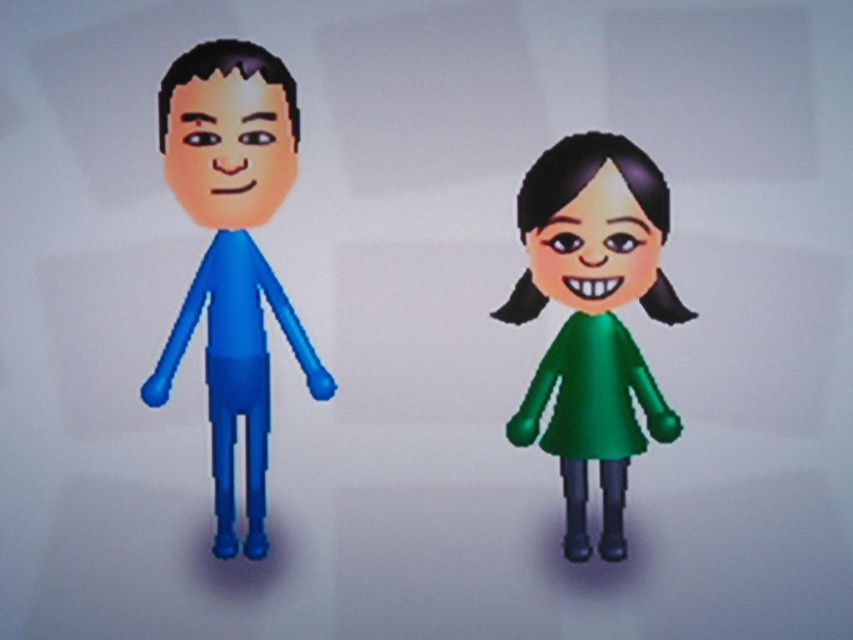
Consider the image. You are an artist trying to draw the two characters from the image. You notice that the matte orange face at left and the green matte face at right have different sizes. Which face should you make wider in your drawing to match the original image?

The matte orange face at left should be drawn wider than the green matte face at right because its width is larger according to the description.

Consider the image. You are designing a virtual reality game where the two characters must stand close to each other. The system requires knowing if the green matte dress at right can fully cover the matte orange face at left when they are positioned side by side. Can it?

The green matte dress at right is wider than the matte orange face at left, so it can potentially cover the matte orange face at left if positioned correctly.